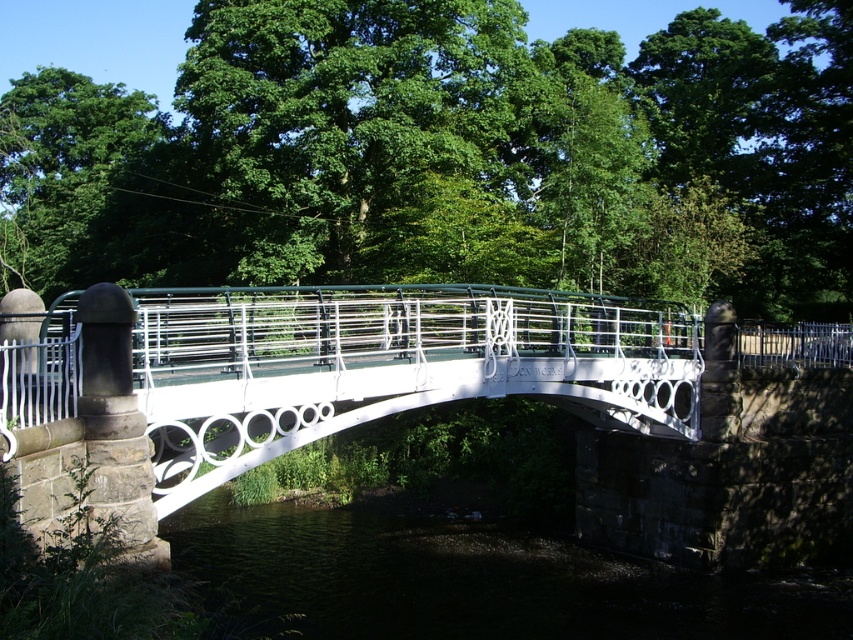
What do you see at coordinates (387, 365) in the screenshot?
I see `white matte pedestrian bridge at center` at bounding box center [387, 365].

Can you confirm if white matte pedestrian bridge at center is positioned to the right of dark water at lower center?

No, white matte pedestrian bridge at center is not to the right of dark water at lower center.

In order to click on white matte pedestrian bridge at center in this screenshot , I will do `click(387, 365)`.

Identify the location of white matte pedestrian bridge at center. Image resolution: width=853 pixels, height=640 pixels. (387, 365).